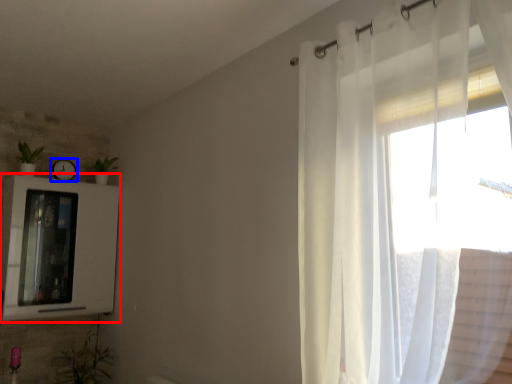
Question: Among these objects, which one is nearest to the camera, medicine cabinet (highlighted by a red box) or clock (highlighted by a blue box)?

Choices:
 (A) medicine cabinet
 (B) clock

Answer: (A)